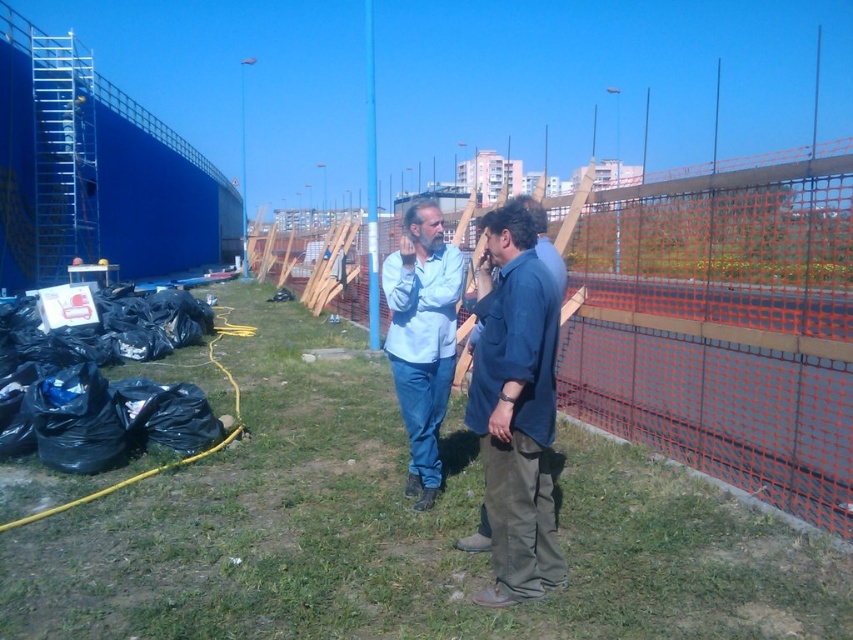
Question: Is green grass at center positioned before light blue shirt at center?

Choices:
 (A) no
 (B) yes

Answer: (B)

Question: Does orange mesh fence at center appear under light blue shirt at center?

Choices:
 (A) yes
 (B) no

Answer: (B)

Question: Can you confirm if green grass at center is bigger than light blue shirt at center?

Choices:
 (A) yes
 (B) no

Answer: (B)

Question: Among these objects, which one is nearest to the camera?

Choices:
 (A) orange mesh fence at center
 (B) green grass at center
 (C) light blue shirt at center
 (D) blue cotton shirt at center

Answer: (B)

Question: Which point appears farthest from the camera in this image?

Choices:
 (A) (563, 294)
 (B) (461, 624)

Answer: (A)

Question: Which object is closer to the camera taking this photo?

Choices:
 (A) orange mesh fence at center
 (B) green grass at center
 (C) light blue shirt at center

Answer: (B)